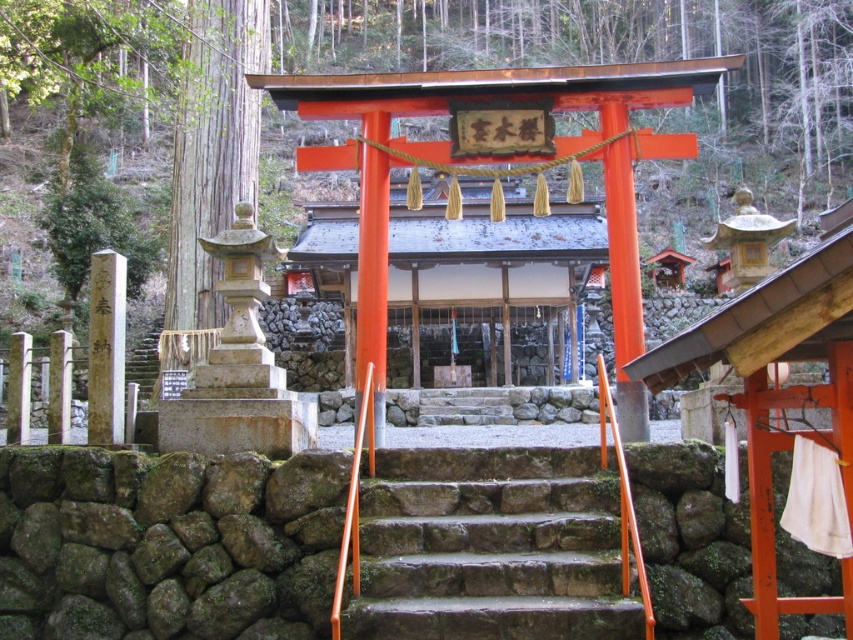
Which is more to the right, mossy stone stairs at center or brown stone pillar at left?

Positioned to the right is mossy stone stairs at center.

Between mossy stone stairs at center and brown stone pillar at left, which one is positioned higher?

brown stone pillar at left

Where is `mossy stone stairs at center`? The image size is (853, 640). mossy stone stairs at center is located at coordinates pyautogui.click(x=490, y=547).

Does orange glossy torii gate at center have a greater height compared to brown stone pillar at left?

Yes, orange glossy torii gate at center is taller than brown stone pillar at left.

Is orange glossy torii gate at center wider than brown stone pillar at left?

In fact, orange glossy torii gate at center might be narrower than brown stone pillar at left.

Which is in front, point (368, 230) or point (114, 348)?

Point (114, 348) is more forward.

Locate an element on the screen. Image resolution: width=853 pixels, height=640 pixels. orange glossy torii gate at center is located at coordinates (372, 280).

Between mossy stone stairs at center and orange glossy torii gate at center, which one is positioned lower?

mossy stone stairs at center is lower down.

Who is more forward, (403,589) or (370,198)?

Point (403,589) is in front.

Find the location of `mossy stone stairs at center`. mossy stone stairs at center is located at coordinates (490, 547).